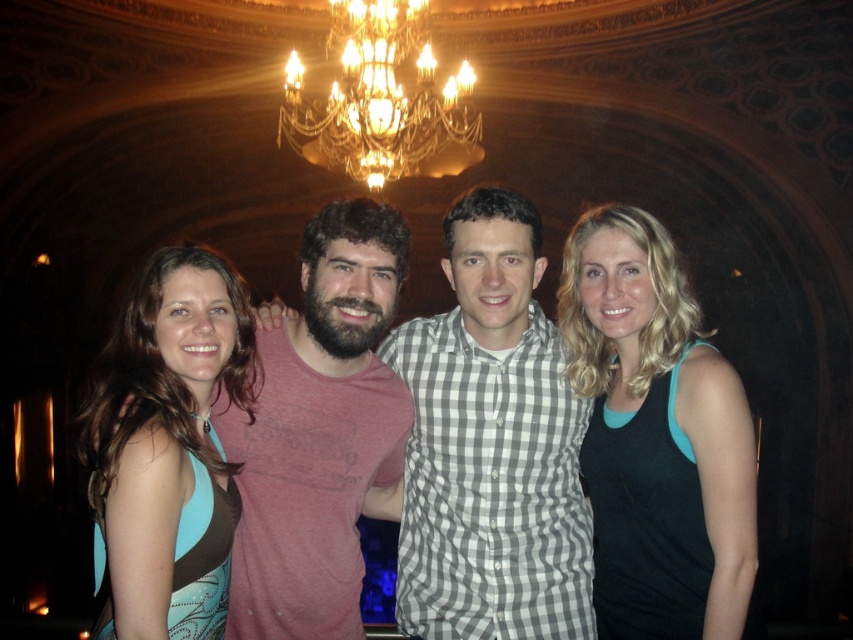
You are a photographer setting up for a group photo. You notice the blue fabric dress at left and the gold crystal chandelier at upper center. Which object is closer to the camera based on their positions?

The blue fabric dress at left is closer to the camera because it is positioned in front of the gold crystal chandelier at upper center.

In the scene described, there are two men wearing a checkered fabric shirt at center and a black matte tank top at right. Which one of them is wearing a larger clothing item?

The checkered fabric shirt at center has a larger size compared to the black matte tank top at right, so the man wearing the checkered fabric shirt at center is wearing the larger clothing item.